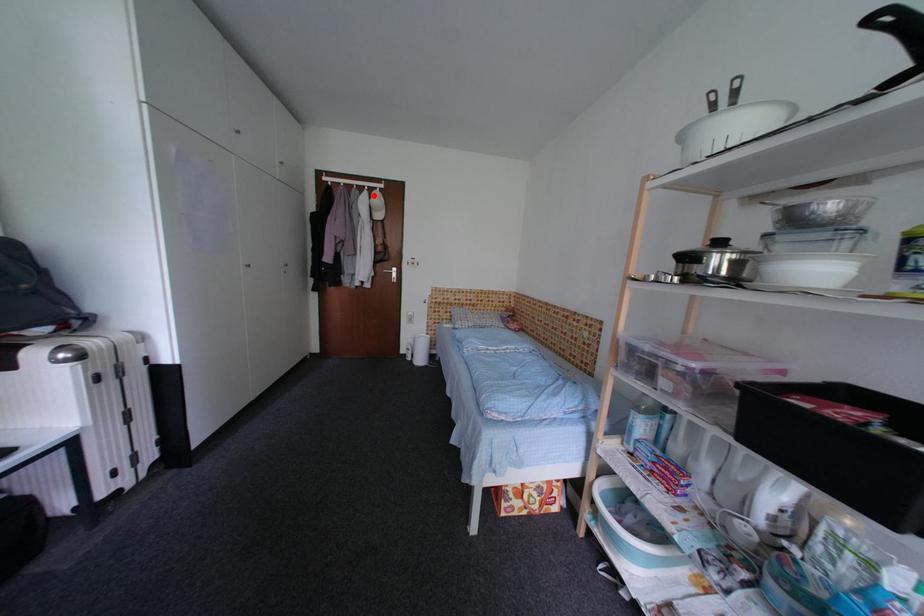
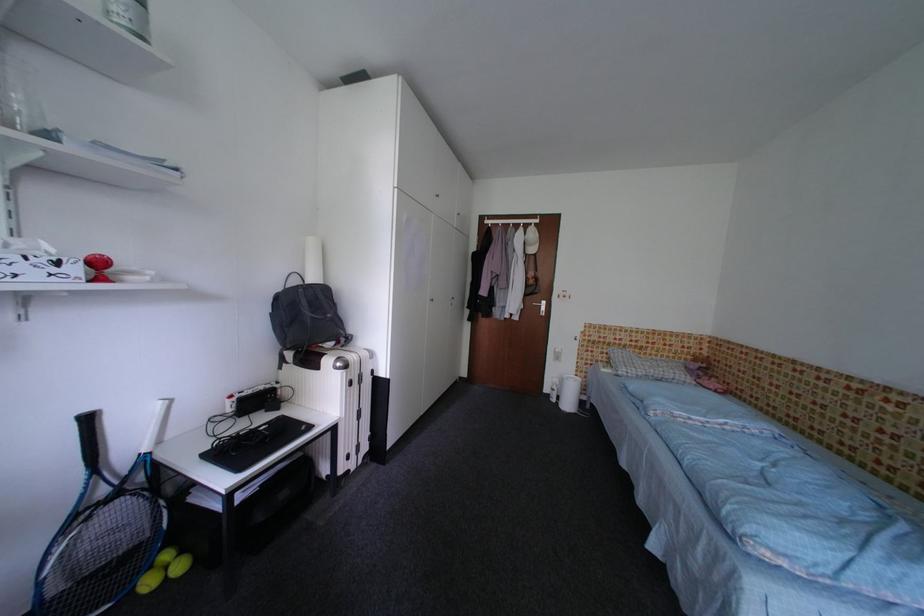
Find the pixel in the second image that matches the highlighted location in the first image.

(529, 232)